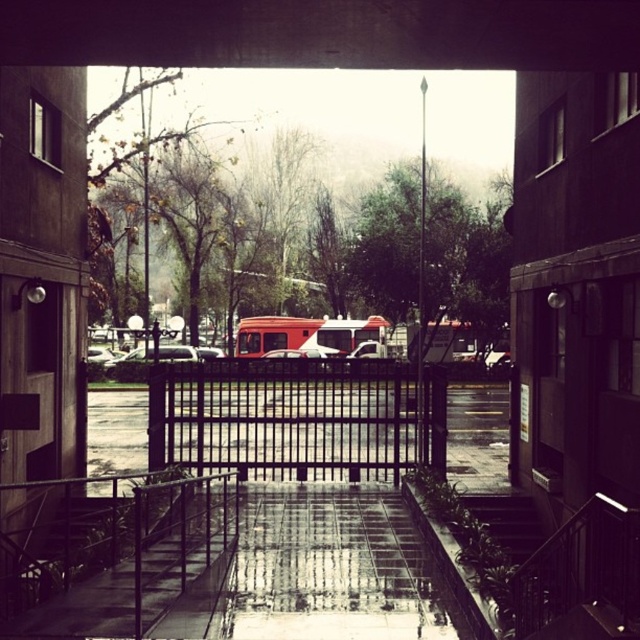
Question: Can you confirm if concrete at center is bigger than metal/rusty fence at center?

Choices:
 (A) no
 (B) yes

Answer: (B)

Question: Is concrete at center positioned in front of metal/rusty fence at center?

Choices:
 (A) no
 (B) yes

Answer: (B)

Question: Where is concrete at center located in relation to metal/rusty fence at center in the image?

Choices:
 (A) right
 (B) left

Answer: (A)

Question: Which object is positioned farthest from the black metal fence at center?

Choices:
 (A) concrete at center
 (B) metal/rusty fence at center

Answer: (A)

Question: Which point is farther to the camera?

Choices:
 (A) (221, 424)
 (B) (97, 595)

Answer: (A)

Question: Which of the following is the farthest from the observer?

Choices:
 (A) metal/rusty fence at center
 (B) concrete at center
 (C) black metal fence at center

Answer: (C)